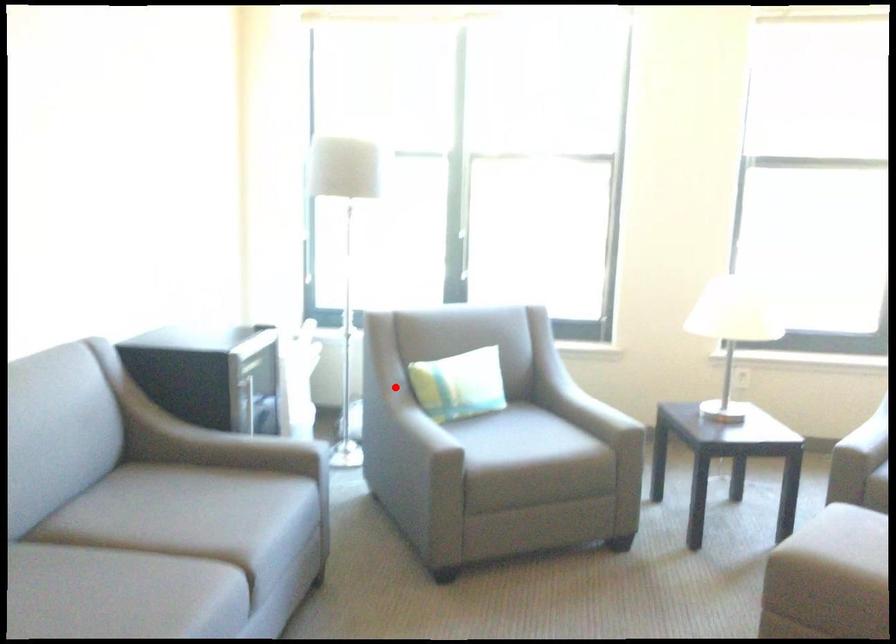
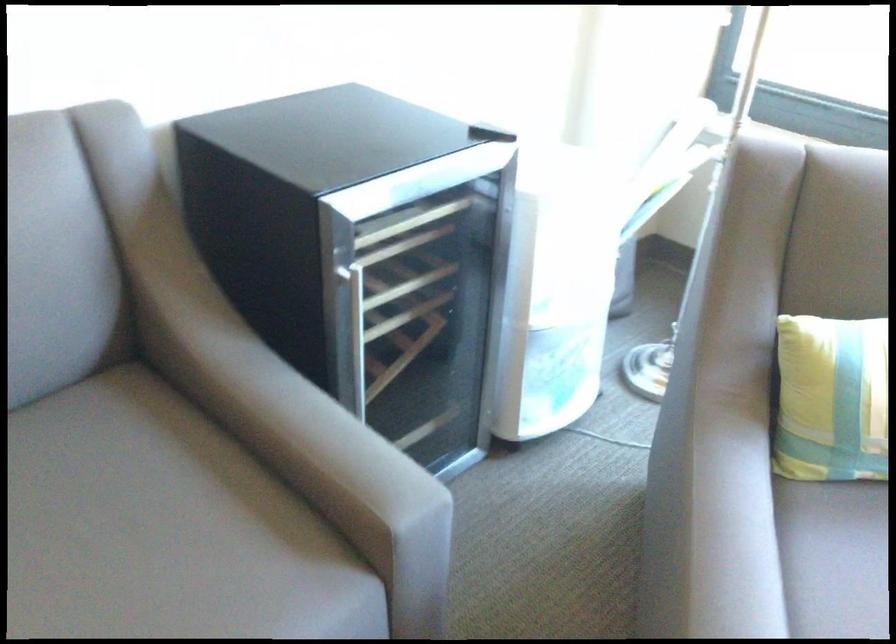
Where in the second image is the point corresponding to the highlighted location from the first image?

(831, 399)